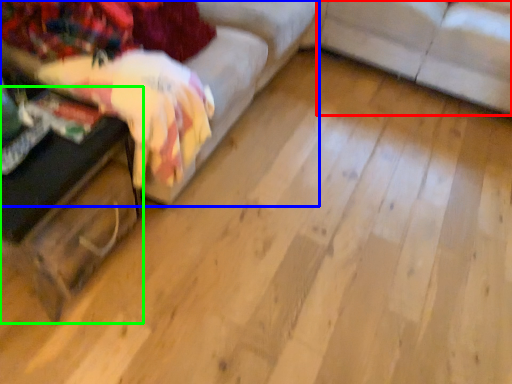
Question: Which object is positioned closest to studio couch (highlighted by a red box)? Select from studio couch (highlighted by a blue box) and table (highlighted by a green box).

Choices:
 (A) studio couch
 (B) table

Answer: (A)